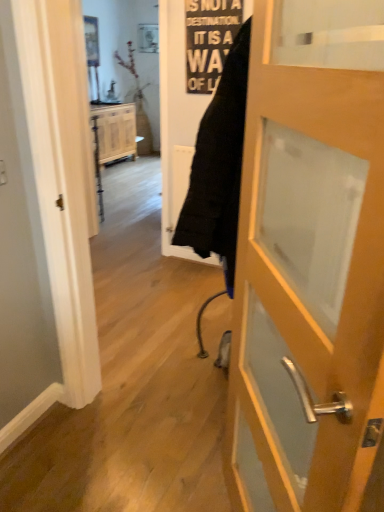
Question: Does point (223, 13) appear closer or farther from the camera than point (289, 112)?

Choices:
 (A) closer
 (B) farther

Answer: (B)

Question: Considering their positions, is black paper sign at upper center located in front of or behind wooden door at center?

Choices:
 (A) front
 (B) behind

Answer: (B)

Question: Estimate the real-world distances between objects in this image. Which object is closer to the black paper sign at upper center?

Choices:
 (A) wooden door at center
 (B) wooden cabinet at center

Answer: (A)

Question: Which is nearer to the black paper sign at upper center?

Choices:
 (A) wooden door at center
 (B) wooden cabinet at center

Answer: (A)